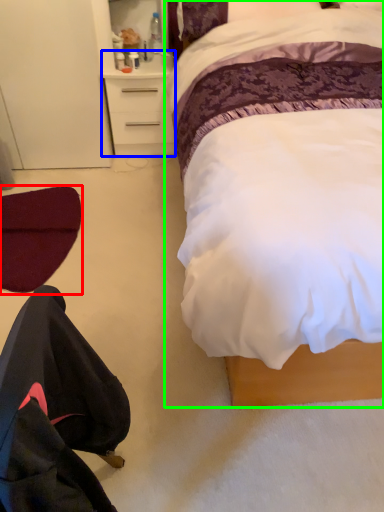
Question: Which object is positioned closest to swivel chair (highlighted by a red box)? Select from desk (highlighted by a blue box) and bed (highlighted by a green box).

Choices:
 (A) desk
 (B) bed

Answer: (A)